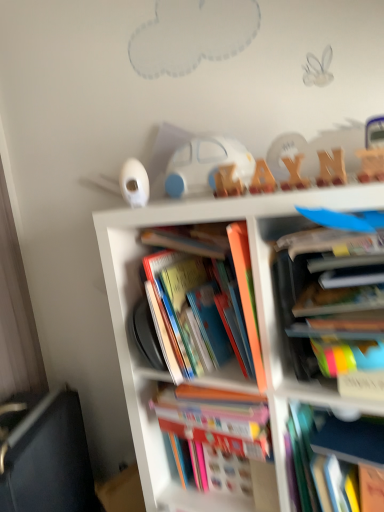
Question: Are hardcover book at center, the second book from the top, and multicolored cardboard books at center far apart?

Choices:
 (A) yes
 (B) no

Answer: (B)

Question: From the image's perspective, is hardcover book at center, the second book from the top, beneath multicolored cardboard books at center?

Choices:
 (A) yes
 (B) no

Answer: (B)

Question: Is hardcover book at center, the second book from the top, to the left of multicolored cardboard books at center from the viewer's perspective?

Choices:
 (A) no
 (B) yes

Answer: (B)

Question: Considering the relative sizes of hardcover book at center, the second book from the top, and multicolored cardboard books at center in the image provided, is hardcover book at center, the second book from the top, wider than multicolored cardboard books at center?

Choices:
 (A) no
 (B) yes

Answer: (A)

Question: From a real-world perspective, is hardcover book at center, the second book from the top, on top of multicolored cardboard books at center?

Choices:
 (A) no
 (B) yes

Answer: (B)

Question: Based on their positions, is hardcover book at center, the 2th book positioned from the bottom, located to the left or right of hardcover book at center, marked as the fourth book in a bottom-to-top arrangement?

Choices:
 (A) left
 (B) right

Answer: (B)

Question: From the image's perspective, is hardcover book at center, the 2th book positioned from the bottom, positioned above or below hardcover book at center, the second book from the top?

Choices:
 (A) below
 (B) above

Answer: (A)

Question: In the image, is hardcover book at center, marked as the fourth book in a top-to-bottom arrangement, positioned in front of or behind hardcover book at center, marked as the fourth book in a bottom-to-top arrangement?

Choices:
 (A) behind
 (B) front

Answer: (B)

Question: From a real-world perspective, is hardcover book at center, marked as the fourth book in a top-to-bottom arrangement, physically located above or below hardcover book at center, marked as the fourth book in a bottom-to-top arrangement?

Choices:
 (A) above
 (B) below

Answer: (B)

Question: Is hardcover book at center, placed as the third book when sorted from bottom to top, situated inside black fabric couch at lower left or outside?

Choices:
 (A) inside
 (B) outside

Answer: (B)

Question: Considering the positions of point (163, 320) and point (94, 497), is point (163, 320) closer or farther from the camera than point (94, 497)?

Choices:
 (A) closer
 (B) farther

Answer: (A)

Question: Considering their positions, is hardcover book at center, placed as the third book when sorted from bottom to top, located in front of or behind black fabric couch at lower left?

Choices:
 (A) front
 (B) behind

Answer: (A)

Question: From a real-world perspective, is hardcover book at center, placed as the third book when sorted from bottom to top, positioned above or below black fabric couch at lower left?

Choices:
 (A) below
 (B) above

Answer: (B)

Question: Considering the positions of point (56, 502) and point (332, 323), is point (56, 502) closer or farther from the camera than point (332, 323)?

Choices:
 (A) closer
 (B) farther

Answer: (B)

Question: Based on their sizes in the image, would you say black fabric couch at lower left is bigger or smaller than multicolored paper book at center right, which ranks as the fifth book in bottom-to-top order?

Choices:
 (A) big
 (B) small

Answer: (A)